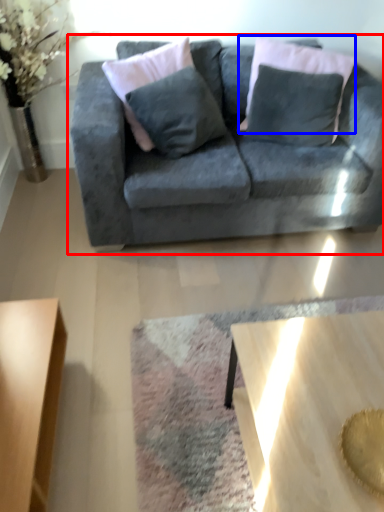
Question: Which object appears farthest to the camera in this image, studio couch (highlighted by a red box) or pillow (highlighted by a blue box)?

Choices:
 (A) studio couch
 (B) pillow

Answer: (B)